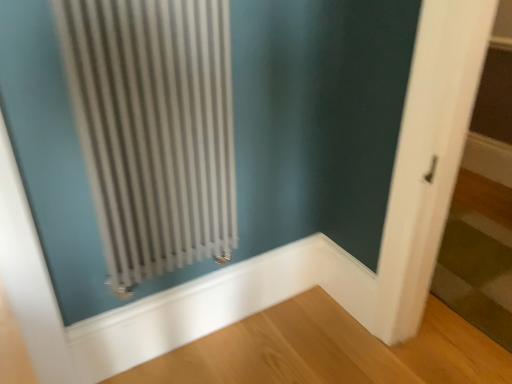
The image size is (512, 384). What do you see at coordinates (154, 129) in the screenshot? I see `white metallic radiator at upper left` at bounding box center [154, 129].

Where is `white metallic radiator at upper left`? white metallic radiator at upper left is located at coordinates (154, 129).

What are the coordinates of `white metallic radiator at upper left` in the screenshot? It's located at (154, 129).